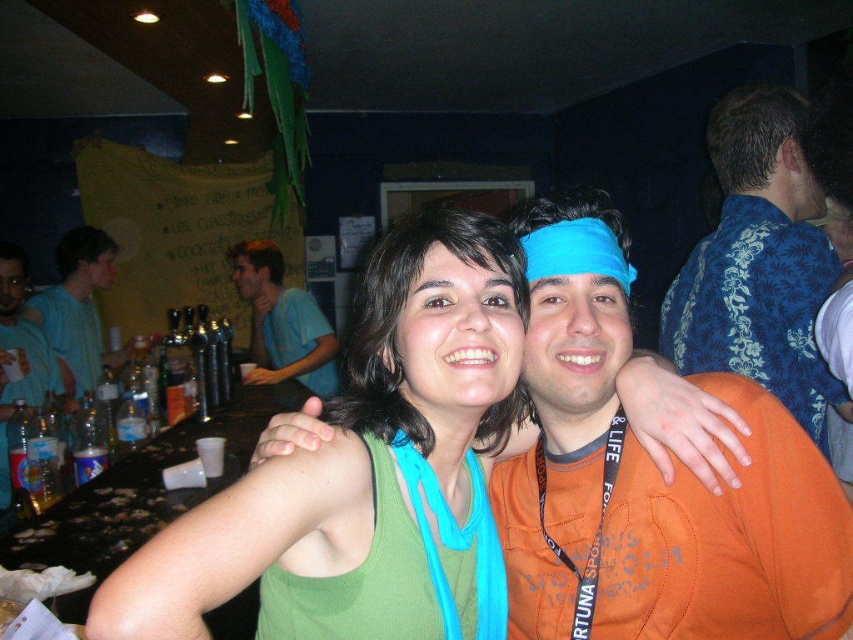
You are standing in front of the bar area at the party and notice the blue fabric lanyard at upper center. If you want to grab it without moving your body, can you reach it with your outstretched hand?

The blue fabric lanyard at upper center is 31.68 inches from viewer. Since the average human arm length is about 25 to 30 inches, you would not be able to reach it without moving your body.

You are taking a photo of the blue fabric lanyard at upper center and the matte blue shirt at left. Which object appears smaller in the photo?

The blue fabric lanyard at upper center appears smaller because it is not as tall as the matte blue shirt at left.